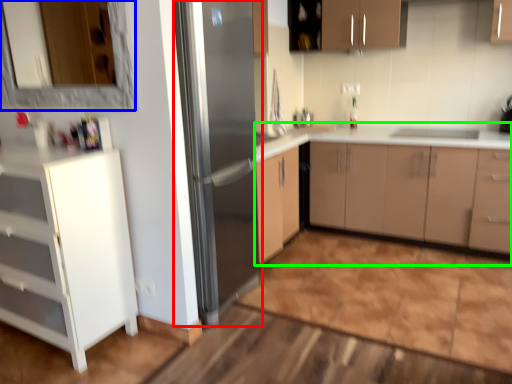
Question: Which is farther away from refrigerator (highlighted by a red box)? mirror (highlighted by a blue box) or cabinetry (highlighted by a green box)?

Choices:
 (A) mirror
 (B) cabinetry

Answer: (A)